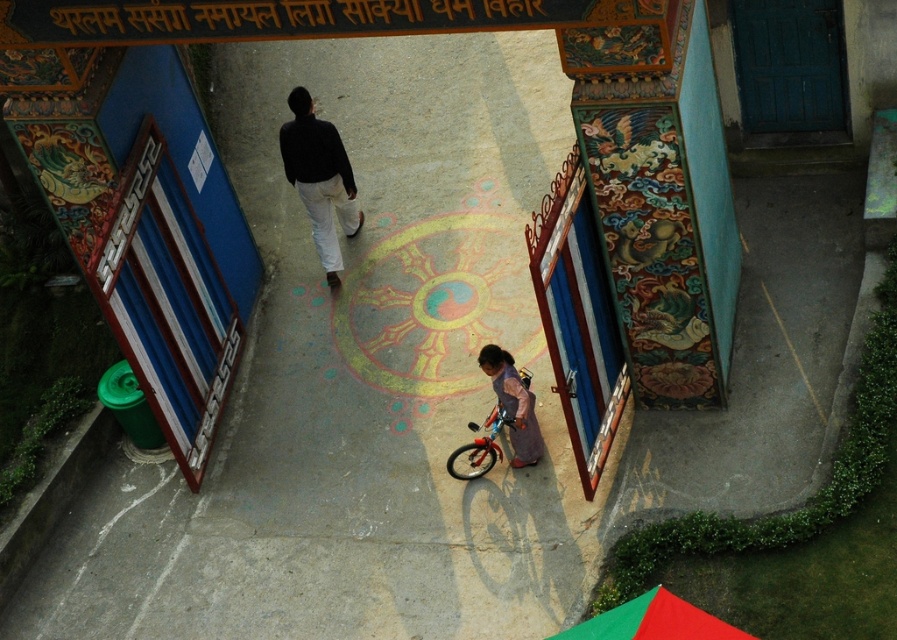
You are a delivery person with a cart that is 2 meters wide. You need to move from the wooden door at center to the blue painted door at upper right. Is there enough space for your cart to pass through the gap between these two doors?

The distance between the wooden door at center and the blue painted door at upper right is 4.22 meters. Since your cart is 2 meters wide, there is sufficient space for it to pass through the gap between the two doors.